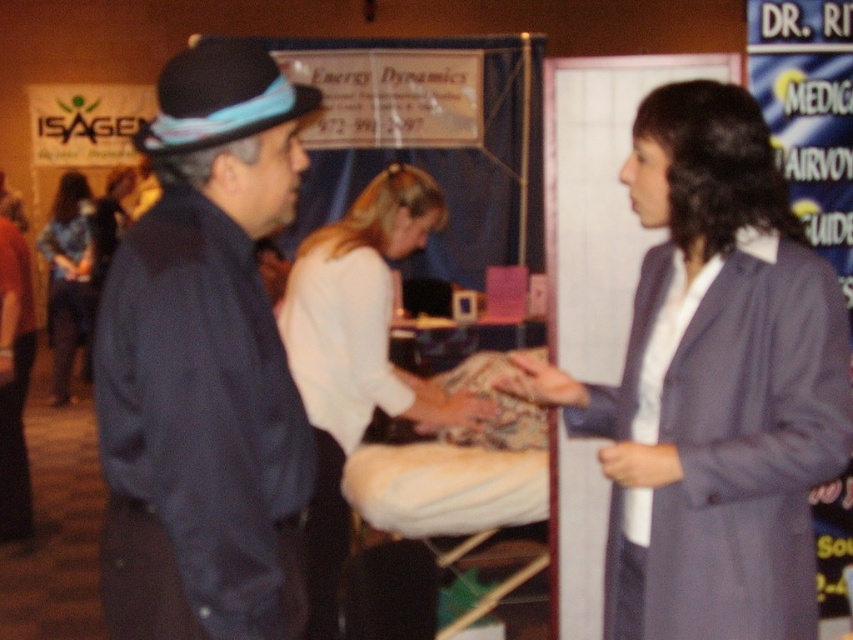
Is point (259, 140) more distant than point (212, 51)?

Yes.

Is point (283, 120) more distant than point (160, 106)?

No, it is not.

The image size is (853, 640). Identify the location of dark blue fabric jacket at left. (206, 365).

Does dark blue fabric jacket at left have a lesser height compared to matte gray blazer at right?

No, dark blue fabric jacket at left is not shorter than matte gray blazer at right.

Who is positioned more to the left, dark blue fabric jacket at left or matte gray blazer at right?

dark blue fabric jacket at left is more to the left.

Between point (196, 608) and point (648, 266), which one is positioned behind?

Point (648, 266)

The height and width of the screenshot is (640, 853). I want to click on dark blue fabric jacket at left, so [206, 365].

Which is in front, point (195, 109) or point (74, 310)?

Point (195, 109)

Does point (231, 77) come farther from viewer compared to point (64, 305)?

No, (231, 77) is closer to viewer.

What do you see at coordinates (219, 97) in the screenshot? Image resolution: width=853 pixels, height=640 pixels. I see `black felt fedora at left` at bounding box center [219, 97].

At what (x,y) coordinates should I click in order to perform the action: click on black felt fedora at left. Please return your answer as a coordinate pair (x, y). Image resolution: width=853 pixels, height=640 pixels. Looking at the image, I should click on (219, 97).